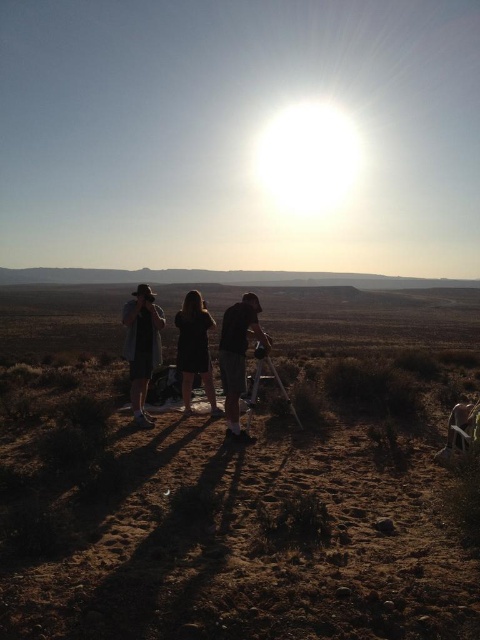
Question: Is dark gray fabric shirt at center positioned behind matte black tripod at center?

Choices:
 (A) no
 (B) yes

Answer: (A)

Question: Observing the image, what is the correct spatial positioning of dark gray shirt at center in reference to black fabric dress at center?

Choices:
 (A) above
 (B) below

Answer: (A)

Question: Among these objects, which one is nearest to the camera?

Choices:
 (A) dark gray shirt at center
 (B) brown dirt at center

Answer: (A)

Question: Does brown dry grass at lower center appear on the left side of dark gray shirt at center?

Choices:
 (A) no
 (B) yes

Answer: (A)

Question: Which object is closer to the camera taking this photo?

Choices:
 (A) dark gray fabric shirt at center
 (B) dark gray shirt at center
 (C) brown dirt at center
 (D) matte black tripod at center

Answer: (A)

Question: Which object is closer to the camera taking this photo?

Choices:
 (A) matte black tripod at center
 (B) dark gray shirt at center

Answer: (A)